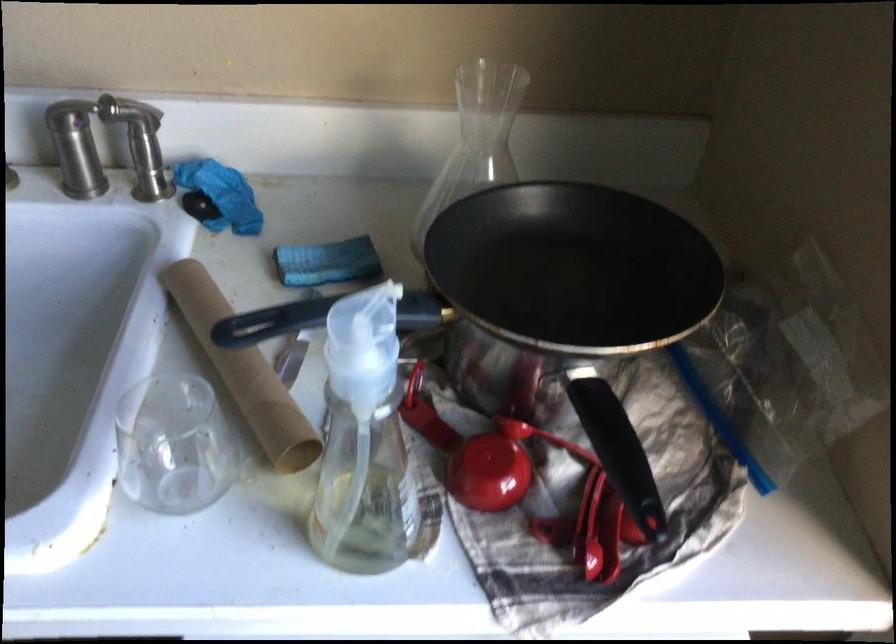
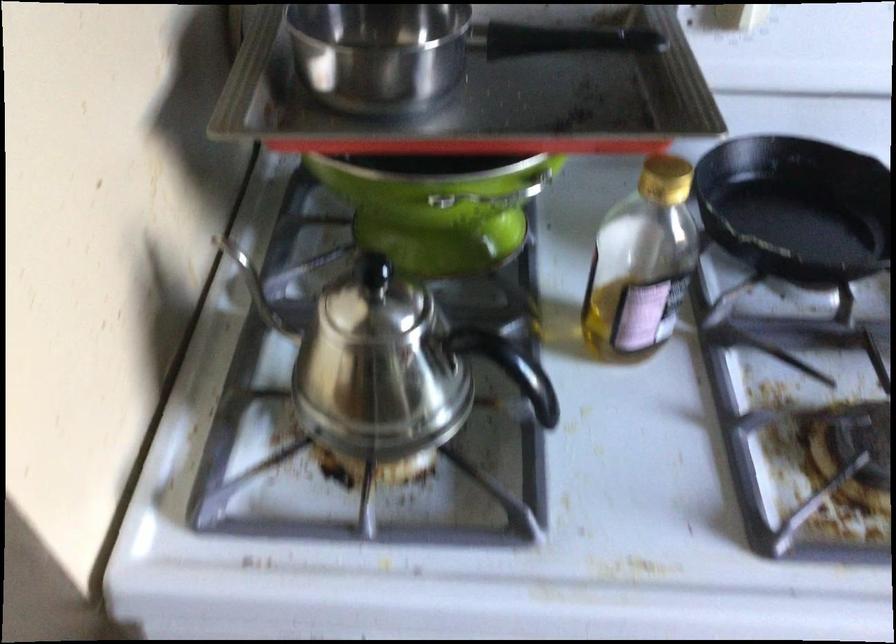
Question: Which direction would the cameraman need to move to produce the second image? Reply with the corresponding letter.

Choices:
 (A) Left
 (B) Right
 (C) Forward
 (D) Backward

Answer: (A)